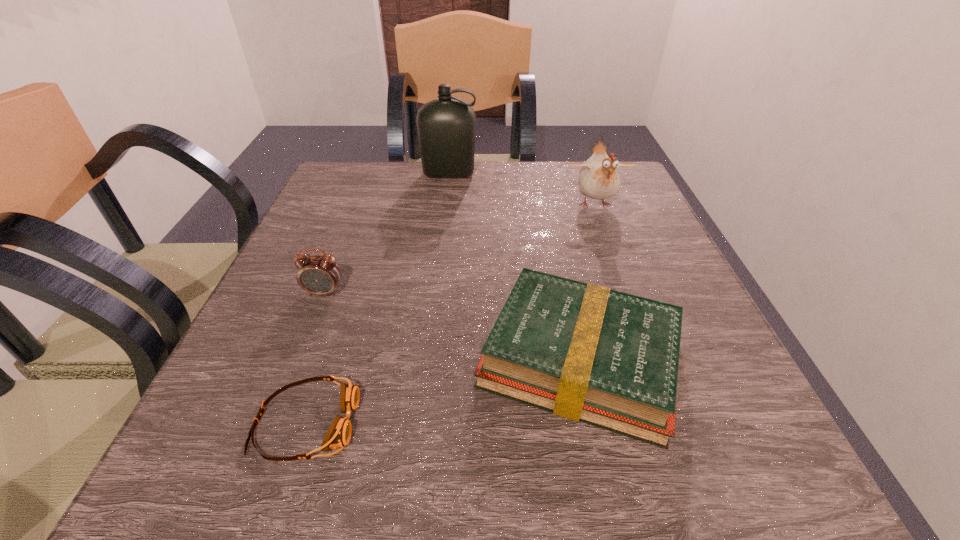
Locate an element on the screen. This screenshot has height=540, width=960. the third object from right to left is located at coordinates (446, 126).

The width and height of the screenshot is (960, 540). I want to click on the farthest object, so click(x=446, y=126).

Image resolution: width=960 pixels, height=540 pixels. Find the location of `the second tallest object`. the second tallest object is located at coordinates tap(599, 179).

This screenshot has width=960, height=540. I want to click on the second farthest object, so click(x=599, y=179).

You are a GUI agent. You are given a task and a screenshot of the screen. Output one action in this format:
    pyautogui.click(x=<x>, y=<y>)
    Task: Click on the alarm clock
    This screenshot has height=540, width=960.
    Given the screenshot: What is the action you would take?
    pyautogui.click(x=319, y=275)

I want to click on hardback book, so click(x=585, y=352).

At what (x,y) coordinates should I click in order to perform the action: click on the shortest object. Please return your answer as a coordinate pair (x, y). The image size is (960, 540). Looking at the image, I should click on (338, 435).

Locate an element on the screen. free region located on the front of the third object from right to left is located at coordinates (444, 222).

Where is `free location located 0.090m at the beak of the bird`? This screenshot has height=540, width=960. free location located 0.090m at the beak of the bird is located at coordinates (611, 246).

What are the coordinates of `free spot located 0.310m on the face of the third shortest object` in the screenshot? It's located at (254, 473).